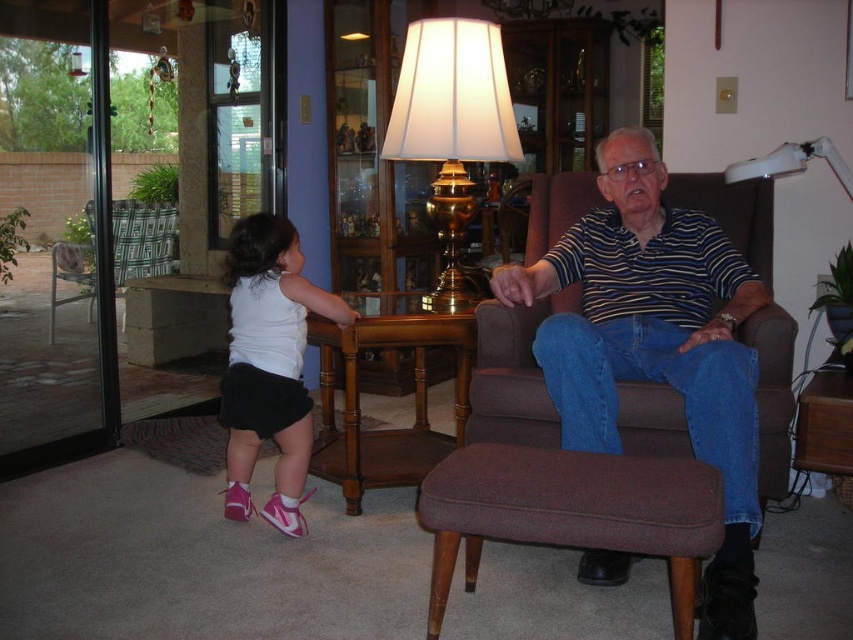
Question: Which is farther from the metallic silver swivel chair at left?

Choices:
 (A) brown fabric stool at lower center
 (B) gold metallic lamp at center

Answer: (A)

Question: Which object is positioned farthest from the white matte tank top at lower left?

Choices:
 (A) transparent glass door at left
 (B) brown fabric stool at lower center

Answer: (A)

Question: Is striped cotton shirt at center smaller than transparent glass door at left?

Choices:
 (A) no
 (B) yes

Answer: (A)

Question: Is striped cotton shirt at center positioned in front of white matte tank top at lower left?

Choices:
 (A) yes
 (B) no

Answer: (A)

Question: Is white matte tank top at lower left to the left of metallic silver swivel chair at left from the viewer's perspective?

Choices:
 (A) yes
 (B) no

Answer: (B)

Question: Which object appears farthest from the camera in this image?

Choices:
 (A) gold metallic lamp at center
 (B) transparent glass door at left
 (C) metallic silver swivel chair at left

Answer: (C)